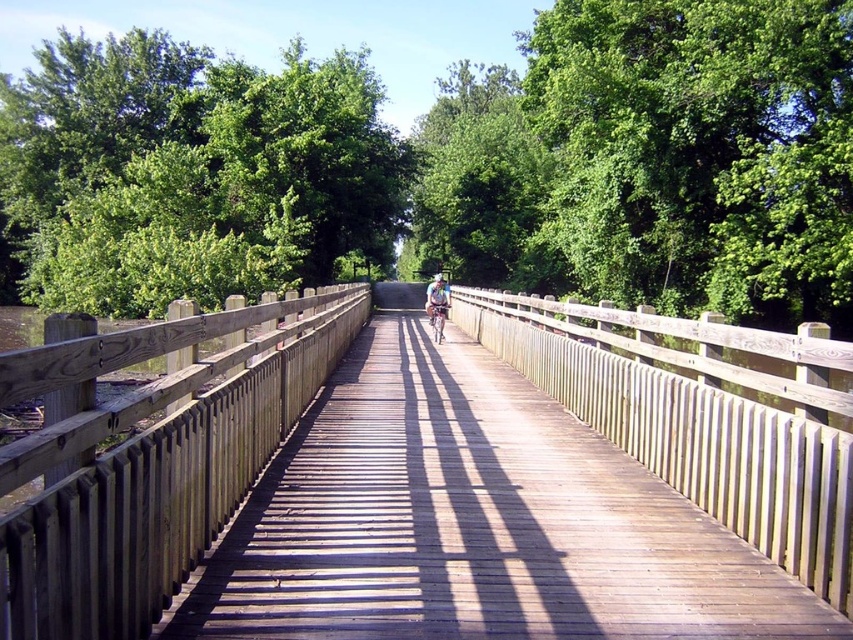
You are a hiker carrying a backpack and see the light blue fabric jacket at center and the white matte bicycle helmet at center on the wooden bridge. You want to pick up both items without moving more than 3 feet from your current position. Is this possible?

The light blue fabric jacket at center and white matte bicycle helmet at center are 3.62 feet apart. Since the distance between them is greater than 3 feet, you cannot pick up both items without moving more than 3 feet from your current position.

You are standing on the wooden bridge and see a light blue fabric jacket at center and a metallic silver bicycle at center. Which object is positioned higher relative to the other?

The light blue fabric jacket at center is located above the metallic silver bicycle at center, so it is positioned higher.

Looking at this image, you are standing on the wooden bridge and want to know how far the point at coordinates point (427,284) is from you. Can you determine the distance?

The distance of point (427,284) from viewer is 63.57 meters.